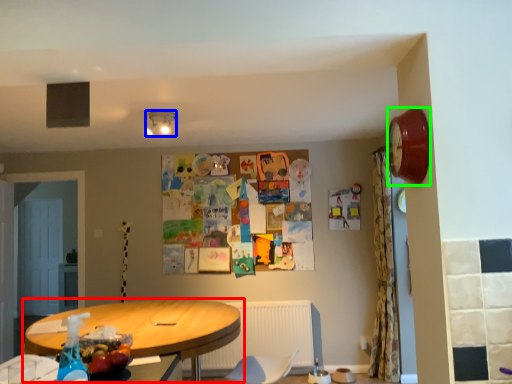
Question: Which object is positioned closest to table (highlighted by a red box)? Select from lamp (highlighted by a blue box) and clock (highlighted by a green box).

Choices:
 (A) lamp
 (B) clock

Answer: (A)